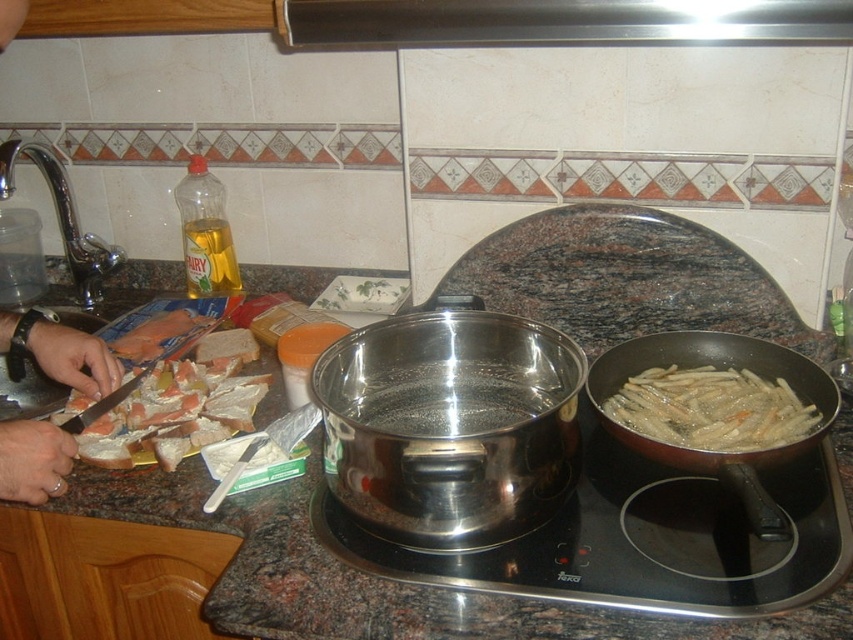
You are standing at the center of the kitchen and see two points marked in the image. Which point, point (252, 588) or point (778, 381), is closer to you?

Point (252, 588) is closer to you because it is in front of point (778, 381).

Based on the photo, you are a chef preparing a dish and need to place the golden crispy fries at right on the granite countertop at center. Can you stack them vertically without them falling over?

The granite countertop at center is much taller than golden crispy fries at right, so yes, you can stack them vertically without them falling over because the countertop provides a stable, elevated surface.